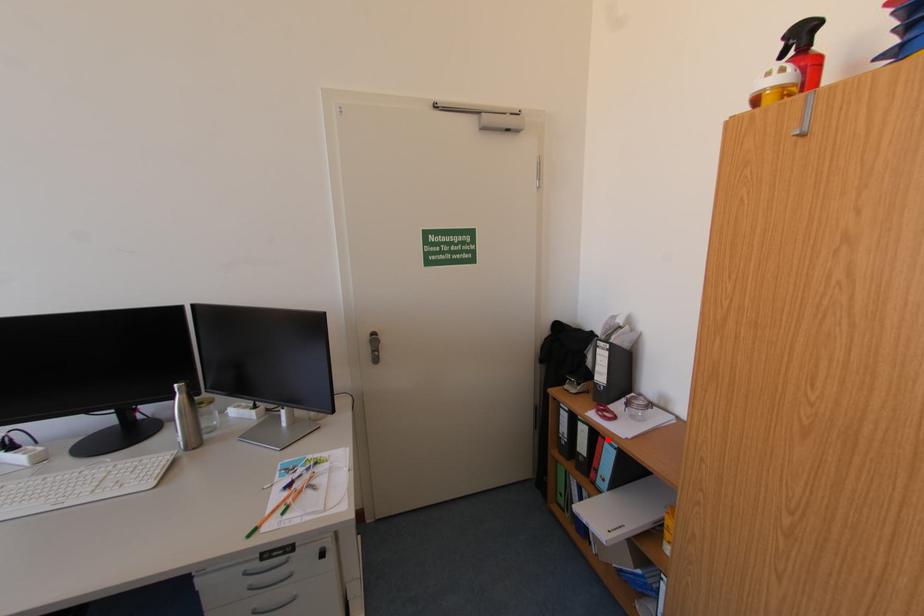
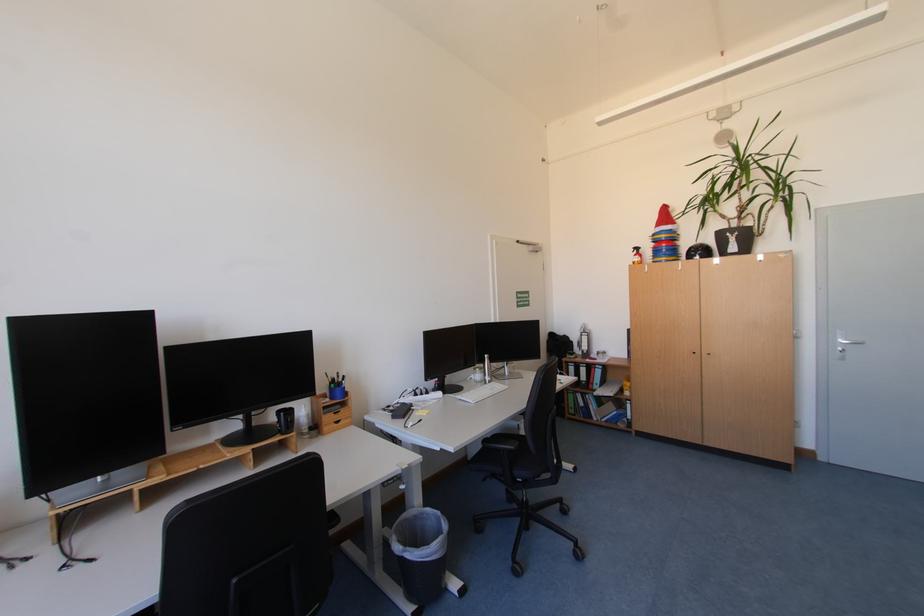
Question: A red point is marked in image1. In image2, is the corresponding 3D point closer to the camera or farther? Reply with the corresponding letter.

Choices:
 (A) The corresponding 3D point is closer.
 (B) The corresponding 3D point is farther.

Answer: (B)